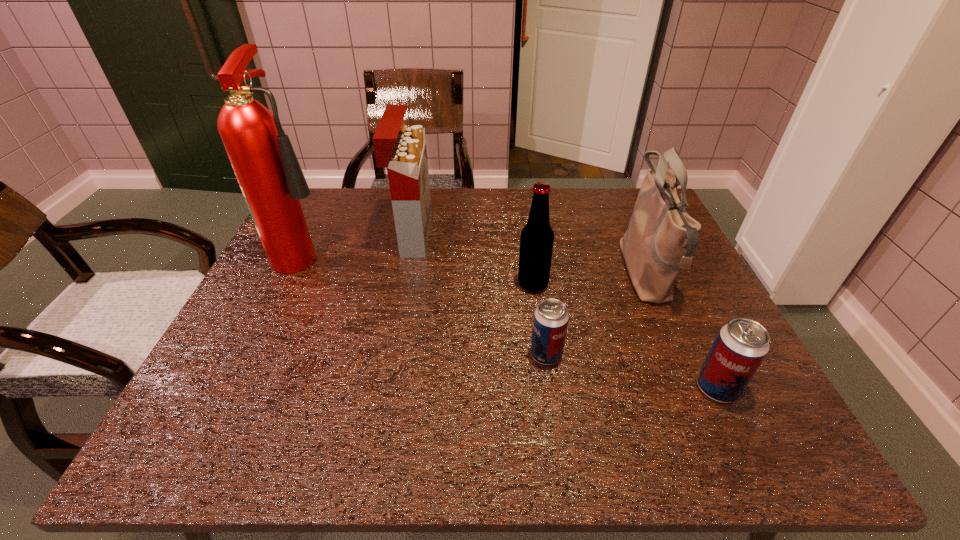
This screenshot has height=540, width=960. Find the location of `free location that satisfies the following two spatial constraints: 1. with the lid open on the second object from left to right; 2. on the right side of the beer bottle`. free location that satisfies the following two spatial constraints: 1. with the lid open on the second object from left to right; 2. on the right side of the beer bottle is located at coordinates (403, 285).

This screenshot has width=960, height=540. I want to click on vacant region that satisfies the following two spatial constraints: 1. at the nozzle of the fifth tallest object; 2. on the left side of the tallest object, so click(241, 388).

Where is `free location that satisfies the following two spatial constraints: 1. at the nozzle of the third shortest object; 2. on the right side of the tallest object`? The height and width of the screenshot is (540, 960). free location that satisfies the following two spatial constraints: 1. at the nozzle of the third shortest object; 2. on the right side of the tallest object is located at coordinates (291, 285).

You are a GUI agent. You are given a task and a screenshot of the screen. Output one action in this format:
    pyautogui.click(x=<x>, y=<y>)
    Task: Click on the vacant space that satisfies the following two spatial constraints: 1. on the front side of the third shortest object; 2. on the left side of the shortest object
    Image resolution: width=960 pixels, height=540 pixels.
    Given the screenshot: What is the action you would take?
    pyautogui.click(x=542, y=354)